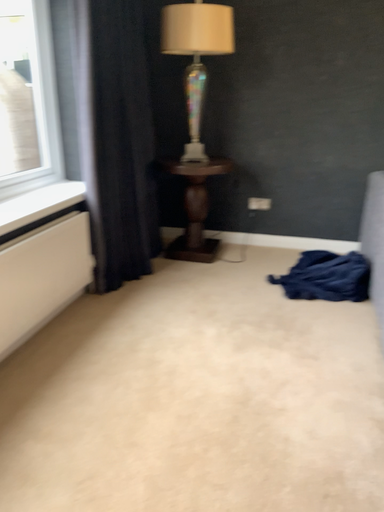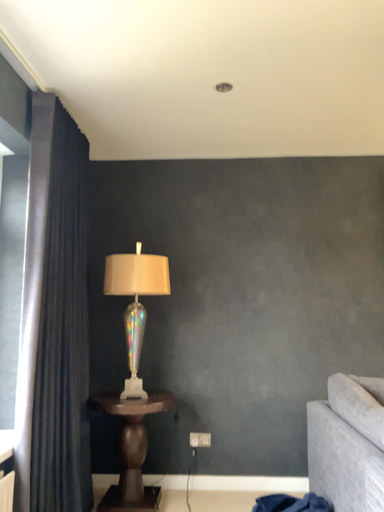
Question: How did the camera likely rotate when shooting the video?

Choices:
 (A) rotated left
 (B) rotated right

Answer: (B)